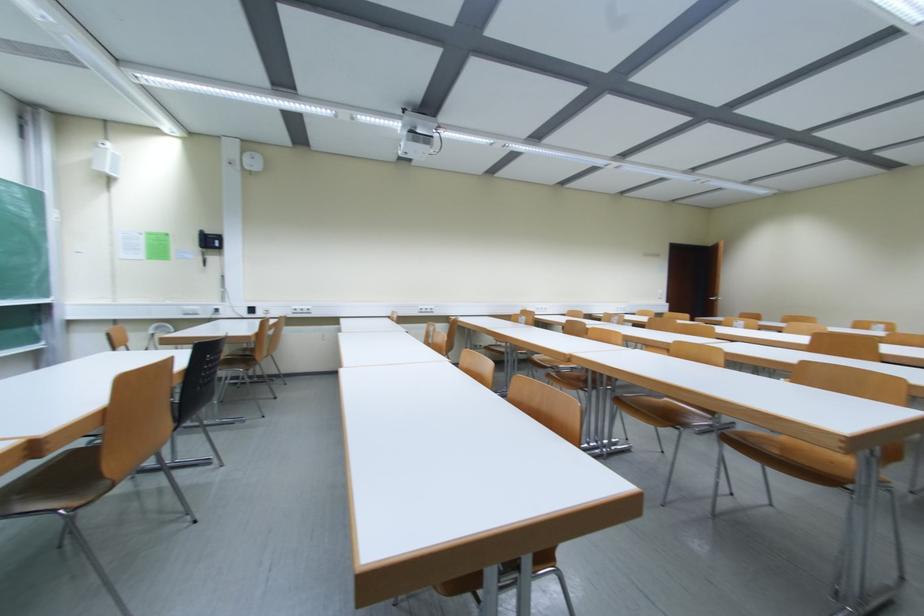
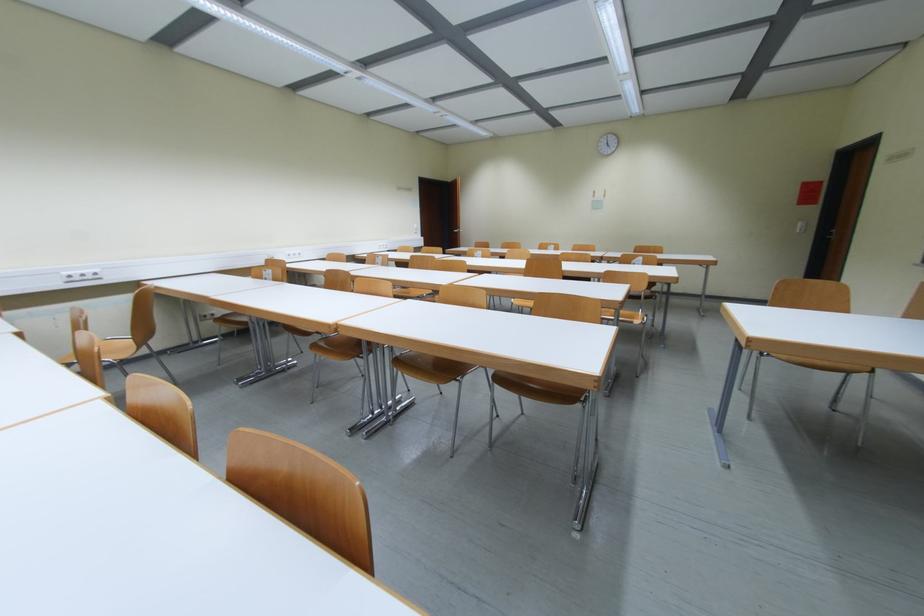
Question: The camera is either moving clockwise (left) or counter-clockwise (right) around the object. The first image is from the beginning of the video and the second image is from the end. Is the camera moving left or right when shooting the video?

Choices:
 (A) Left
 (B) Right

Answer: (A)